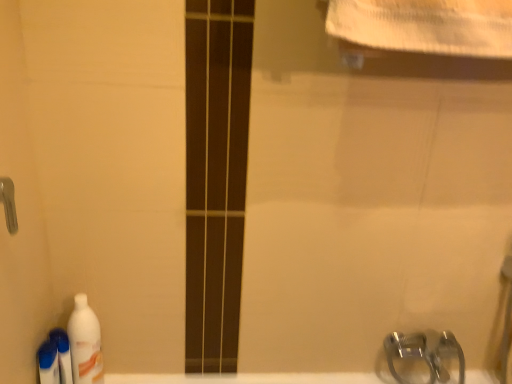
Question: Is translucent plastic bottle at lower left, the 3th cleaning product positioned from the right, turned away from white glossy bottle at lower left, which ranks as the third cleaning product in left-to-right order?

Choices:
 (A) yes
 (B) no

Answer: (B)

Question: Is translucent plastic bottle at lower left, the 3th cleaning product positioned from the right, not close to white glossy bottle at lower left, which ranks as the third cleaning product in left-to-right order?

Choices:
 (A) yes
 (B) no

Answer: (B)

Question: From a real-world perspective, is translucent plastic bottle at lower left, the 3th cleaning product positioned from the right, positioned over white glossy bottle at lower left, which ranks as the first cleaning product in right-to-left order, based on gravity?

Choices:
 (A) yes
 (B) no

Answer: (B)

Question: Is translucent plastic bottle at lower left, the 3th cleaning product positioned from the right, thinner than white glossy bottle at lower left, which ranks as the third cleaning product in left-to-right order?

Choices:
 (A) no
 (B) yes

Answer: (B)

Question: Is translucent plastic bottle at lower left, the 1th cleaning product in the left-to-right sequence, smaller than white glossy bottle at lower left, which ranks as the first cleaning product in right-to-left order?

Choices:
 (A) no
 (B) yes

Answer: (B)

Question: Is translucent plastic bottle at lower left, the 3th cleaning product positioned from the right, further to camera compared to white glossy bottle at lower left, which ranks as the third cleaning product in left-to-right order?

Choices:
 (A) yes
 (B) no

Answer: (B)

Question: Is white glossy bottle at lower left, which ranks as the third cleaning product in left-to-right order, shorter than translucent plastic bottle at lower left, the 3th cleaning product positioned from the right?

Choices:
 (A) yes
 (B) no

Answer: (B)

Question: From the image's perspective, would you say white glossy bottle at lower left, which ranks as the first cleaning product in right-to-left order, is positioned over translucent plastic bottle at lower left, the 3th cleaning product positioned from the right?

Choices:
 (A) yes
 (B) no

Answer: (A)

Question: Is white glossy bottle at lower left, which ranks as the third cleaning product in left-to-right order, closer to camera compared to translucent plastic bottle at lower left, the 1th cleaning product in the left-to-right sequence?

Choices:
 (A) no
 (B) yes

Answer: (A)

Question: Considering the relative positions of white glossy bottle at lower left, which ranks as the first cleaning product in right-to-left order, and translucent plastic bottle at lower left, the 1th cleaning product in the left-to-right sequence, in the image provided, is white glossy bottle at lower left, which ranks as the first cleaning product in right-to-left order, to the right of translucent plastic bottle at lower left, the 1th cleaning product in the left-to-right sequence, from the viewer's perspective?

Choices:
 (A) no
 (B) yes

Answer: (B)

Question: Is white glossy bottle at lower left, which ranks as the first cleaning product in right-to-left order, positioned with its back to translucent plastic bottle at lower left, the 1th cleaning product in the left-to-right sequence?

Choices:
 (A) yes
 (B) no

Answer: (B)

Question: Does white glossy bottle at lower left, which ranks as the first cleaning product in right-to-left order, touch translucent plastic bottle at lower left, the 3th cleaning product positioned from the right?

Choices:
 (A) no
 (B) yes

Answer: (B)

Question: Is white glossy bath at lower center completely or partially inside white glossy bottle at lower left, which ranks as the third cleaning product in left-to-right order?

Choices:
 (A) yes
 (B) no

Answer: (B)